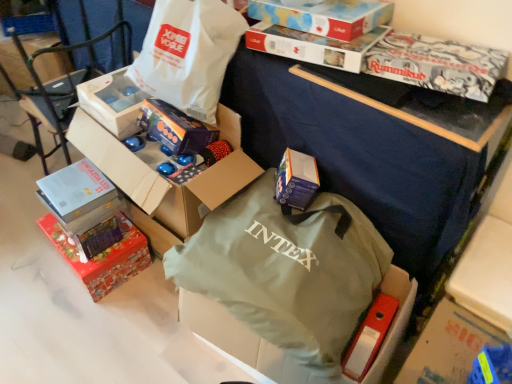
Question: Considering the relative sizes of blue cardboard box at center, the second box in the bottom-to-top sequence, and green fabric bag at center, acting as the first bag starting from the bottom, in the image provided, is blue cardboard box at center, the second box in the bottom-to-top sequence, taller than green fabric bag at center, acting as the first bag starting from the bottom,?

Choices:
 (A) yes
 (B) no

Answer: (B)

Question: From a real-world perspective, is blue cardboard box at center, which ranks as the fourth box in top-to-bottom order, physically above green fabric bag at center, acting as the first bag starting from the bottom?

Choices:
 (A) no
 (B) yes

Answer: (B)

Question: From a real-world perspective, is blue cardboard box at center, the second box in the bottom-to-top sequence, positioned under green fabric bag at center, acting as the first bag starting from the bottom, based on gravity?

Choices:
 (A) yes
 (B) no

Answer: (B)

Question: Is green fabric bag at center, acting as the first bag starting from the bottom, inside blue cardboard box at center, which ranks as the fourth box in top-to-bottom order?

Choices:
 (A) yes
 (B) no

Answer: (B)

Question: Is blue cardboard box at center, the second box in the bottom-to-top sequence, looking in the opposite direction of green fabric bag at center, acting as the first bag starting from the bottom?

Choices:
 (A) yes
 (B) no

Answer: (B)

Question: Is blue cardboard box at center, the second box in the bottom-to-top sequence, with green fabric bag at center, acting as the first bag starting from the bottom?

Choices:
 (A) no
 (B) yes

Answer: (A)

Question: Is blue cardboard box at center, the second box in the bottom-to-top sequence, outside of red glossy gift box at lower left, which appears as the 5th box when viewed from the top?

Choices:
 (A) no
 (B) yes

Answer: (B)

Question: Can you confirm if blue cardboard box at center, the second box in the bottom-to-top sequence, is wider than red glossy gift box at lower left, the first box when ordered from bottom to top?

Choices:
 (A) no
 (B) yes

Answer: (A)

Question: From the image's perspective, is blue cardboard box at center, which ranks as the fourth box in top-to-bottom order, on red glossy gift box at lower left, which appears as the 5th box when viewed from the top?

Choices:
 (A) yes
 (B) no

Answer: (A)

Question: Is blue cardboard box at center, which ranks as the fourth box in top-to-bottom order, behind red glossy gift box at lower left, which appears as the 5th box when viewed from the top?

Choices:
 (A) no
 (B) yes

Answer: (A)

Question: Is blue cardboard box at center, the second box in the bottom-to-top sequence, facing away from red glossy gift box at lower left, the first box when ordered from bottom to top?

Choices:
 (A) no
 (B) yes

Answer: (A)

Question: Can you confirm if blue cardboard box at center, the second box in the bottom-to-top sequence, is smaller than red glossy gift box at lower left, which appears as the 5th box when viewed from the top?

Choices:
 (A) no
 (B) yes

Answer: (B)

Question: Is blue cardboard box at center, the second box in the bottom-to-top sequence, placed right next to matte purple gift box at center?

Choices:
 (A) yes
 (B) no

Answer: (B)